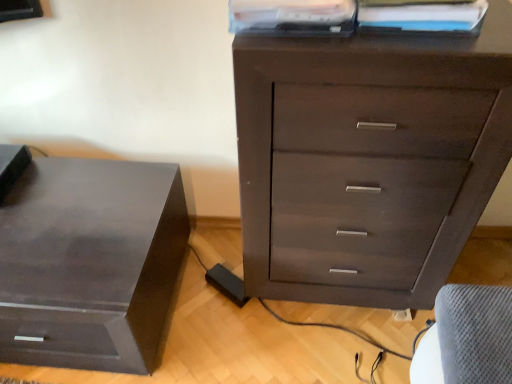
Question: Can you confirm if dark wood chest of drawers at center is positioned to the left of white paper at upper center, positioned as the first book in right-to-left order?

Choices:
 (A) no
 (B) yes

Answer: (B)

Question: Does dark wood chest of drawers at center have a greater width compared to white paper at upper center, positioned as the first book in right-to-left order?

Choices:
 (A) no
 (B) yes

Answer: (B)

Question: From the image's perspective, is dark wood chest of drawers at center located beneath white paper at upper center, the second book viewed from the left?

Choices:
 (A) no
 (B) yes

Answer: (B)

Question: Does dark wood chest of drawers at center come behind white paper at upper center, the second book viewed from the left?

Choices:
 (A) no
 (B) yes

Answer: (A)

Question: Is dark wood chest of drawers at center thinner than white paper at upper center, positioned as the first book in right-to-left order?

Choices:
 (A) yes
 (B) no

Answer: (B)

Question: Can you see dark wood chest of drawers at center touching white paper at upper center, positioned as the first book in right-to-left order?

Choices:
 (A) yes
 (B) no

Answer: (B)

Question: Does white paper at upper center, positioned as the first book in right-to-left order, have a greater width compared to matte plastic book at upper center, the 2th book in the right-to-left sequence?

Choices:
 (A) no
 (B) yes

Answer: (A)

Question: From the image's perspective, is white paper at upper center, positioned as the first book in right-to-left order, beneath matte plastic book at upper center, which is the first book in left-to-right order?

Choices:
 (A) no
 (B) yes

Answer: (B)

Question: Can you confirm if white paper at upper center, positioned as the first book in right-to-left order, is taller than matte plastic book at upper center, the 2th book in the right-to-left sequence?

Choices:
 (A) no
 (B) yes

Answer: (A)

Question: Is white paper at upper center, the second book viewed from the left, positioned behind matte plastic book at upper center, which is the first book in left-to-right order?

Choices:
 (A) yes
 (B) no

Answer: (A)

Question: Can you confirm if white paper at upper center, the second book viewed from the left, is smaller than matte plastic book at upper center, which is the first book in left-to-right order?

Choices:
 (A) no
 (B) yes

Answer: (B)

Question: From the image's perspective, is white paper at upper center, the second book viewed from the left, on top of matte plastic book at upper center, the 2th book in the right-to-left sequence?

Choices:
 (A) no
 (B) yes

Answer: (A)

Question: Can you confirm if matte plastic book at upper center, which is the first book in left-to-right order, is thinner than matte black nightstand at left?

Choices:
 (A) yes
 (B) no

Answer: (A)